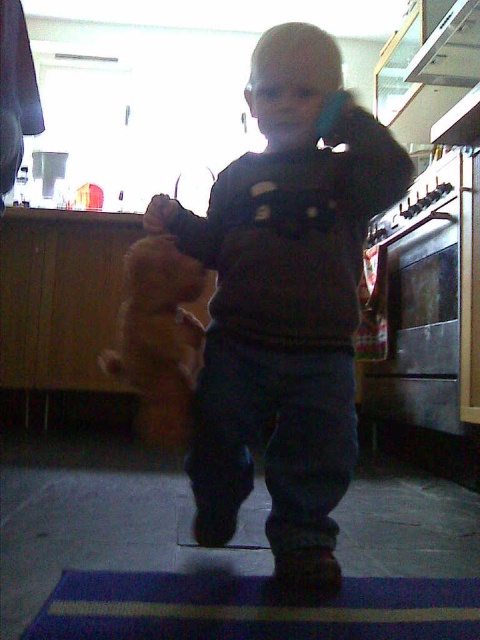
Can you confirm if dark gray sweater at center is positioned to the left of white glossy exhaust hood at upper right?

Correct, you'll find dark gray sweater at center to the left of white glossy exhaust hood at upper right.

Identify the location of dark gray sweater at center. (285, 304).

Identify the location of dark gray sweater at center. (285, 304).

Which is below, blue striped rug at lower center or white glossy exhaust hood at upper right?

Positioned lower is blue striped rug at lower center.

Does blue striped rug at lower center have a lesser width compared to white glossy exhaust hood at upper right?

No.

Who is more forward, (373, 588) or (467, 56)?

Point (373, 588) is in front.

The width and height of the screenshot is (480, 640). What are the coordinates of `blue striped rug at lower center` in the screenshot? It's located at (252, 609).

Which of these two, dark gray sweater at center or blue striped rug at lower center, stands taller?

With more height is dark gray sweater at center.

Is dark gray sweater at center to the right of blue striped rug at lower center from the viewer's perspective?

No, dark gray sweater at center is not to the right of blue striped rug at lower center.

Describe the element at coordinates (285, 304) in the screenshot. The image size is (480, 640). I see `dark gray sweater at center` at that location.

The image size is (480, 640). Identify the location of dark gray sweater at center. (285, 304).